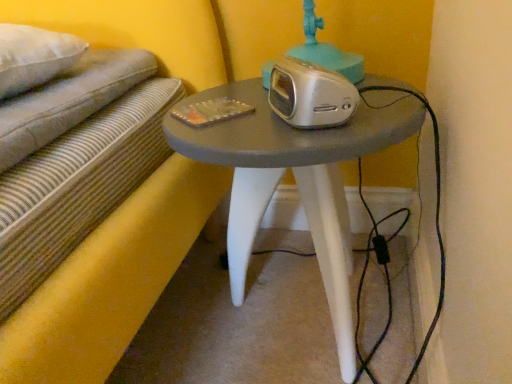
In order to face matte gray table at center, should I rotate leftwards or rightwards?

It's best to rotate right around 5.172 degrees.

Locate an element on the screen. matte gray table at center is located at coordinates (295, 179).

Measure the distance between matte gray table at center and camera.

48.70 centimeters.

The image size is (512, 384). What do you see at coordinates (295, 179) in the screenshot? I see `matte gray table at center` at bounding box center [295, 179].

Where is `silver metallic alarm clock at center`? The image size is (512, 384). silver metallic alarm clock at center is located at coordinates 310,94.

Describe the element at coordinates (310, 94) in the screenshot. I see `silver metallic alarm clock at center` at that location.

At what (x,y) coordinates should I click in order to perform the action: click on matte gray table at center. Please return your answer as a coordinate pair (x, y). The height and width of the screenshot is (384, 512). Looking at the image, I should click on (295, 179).

Between matte gray table at center and silver metallic alarm clock at center, which one appears on the left side from the viewer's perspective?

silver metallic alarm clock at center is more to the left.

Considering the relative positions of matte gray table at center and silver metallic alarm clock at center in the image provided, is matte gray table at center behind silver metallic alarm clock at center?

No, matte gray table at center is closer to the camera.

Which is nearer, (262, 188) or (285, 107)?

The point (285, 107) is in front.

From the image's perspective, is matte gray table at center beneath silver metallic alarm clock at center?

Correct, matte gray table at center appears lower than silver metallic alarm clock at center in the image.

From a real-world perspective, who is located higher, matte gray table at center or silver metallic alarm clock at center?

silver metallic alarm clock at center, from a real-world perspective.

Considering the relative sizes of matte gray table at center and silver metallic alarm clock at center in the image provided, is matte gray table at center thinner than silver metallic alarm clock at center?

In fact, matte gray table at center might be wider than silver metallic alarm clock at center.

Considering the sizes of objects matte gray table at center and silver metallic alarm clock at center in the image provided, who is taller, matte gray table at center or silver metallic alarm clock at center?

With more height is matte gray table at center.

Considering the sizes of matte gray table at center and silver metallic alarm clock at center in the image, is matte gray table at center bigger or smaller than silver metallic alarm clock at center?

Considering their sizes, matte gray table at center takes up more space than silver metallic alarm clock at center.

Is matte gray table at center spatially inside silver metallic alarm clock at center, or outside of it?

matte gray table at center cannot be found inside silver metallic alarm clock at center.

Is matte gray table at center with silver metallic alarm clock at center?

matte gray table at center and silver metallic alarm clock at center are not in contact.

In the scene shown: Is silver metallic alarm clock at center at the back of matte gray table at center?

No, matte gray table at center is not facing the opposite direction of silver metallic alarm clock at center.

Can you tell me how much matte gray table at center and silver metallic alarm clock at center differ in facing direction?

The angle between the facing direction of matte gray table at center and the facing direction of silver metallic alarm clock at center is 60.8 degrees.

Where is `table below the silver metallic alarm clock at center (from the image's perspective)`? This screenshot has width=512, height=384. table below the silver metallic alarm clock at center (from the image's perspective) is located at coordinates (295, 179).

Which object is positioned more to the right, silver metallic alarm clock at center or matte gray table at center?

Positioned to the right is matte gray table at center.

Considering their positions, is silver metallic alarm clock at center located in front of or behind matte gray table at center?

silver metallic alarm clock at center is positioned farther from the viewer than matte gray table at center.

Does point (315, 114) appear closer or farther from the camera than point (318, 204)?

Point (315, 114) is closer to the camera than point (318, 204).

From the image's perspective, is silver metallic alarm clock at center above or below matte gray table at center?

Based on their image positions, silver metallic alarm clock at center is located above matte gray table at center.

From a real-world perspective, between silver metallic alarm clock at center and matte gray table at center, who is vertically lower?

matte gray table at center is physically lower.

Between silver metallic alarm clock at center and matte gray table at center, which one has smaller width?

Thinner between the two is silver metallic alarm clock at center.

Is silver metallic alarm clock at center taller or shorter than matte gray table at center?

In the image, silver metallic alarm clock at center appears to be shorter than matte gray table at center.

Is silver metallic alarm clock at center bigger than matte gray table at center?

No.

Would you say silver metallic alarm clock at center is outside matte gray table at center?

Absolutely, silver metallic alarm clock at center is external to matte gray table at center.

Can you see silver metallic alarm clock at center touching matte gray table at center?

No, silver metallic alarm clock at center is not with matte gray table at center.

From the picture: Could you tell me if silver metallic alarm clock at center is facing matte gray table at center?

No, silver metallic alarm clock at center is not oriented towards matte gray table at center.

The image size is (512, 384). Find the location of `table in front of the silver metallic alarm clock at center`. table in front of the silver metallic alarm clock at center is located at coordinates (295, 179).

Where is `table in front of the silver metallic alarm clock at center`? table in front of the silver metallic alarm clock at center is located at coordinates (295, 179).

At what (x,y) coordinates should I click in order to perform the action: click on stereo behind the matte gray table at center. Please return your answer as a coordinate pair (x, y). Looking at the image, I should click on (310, 94).